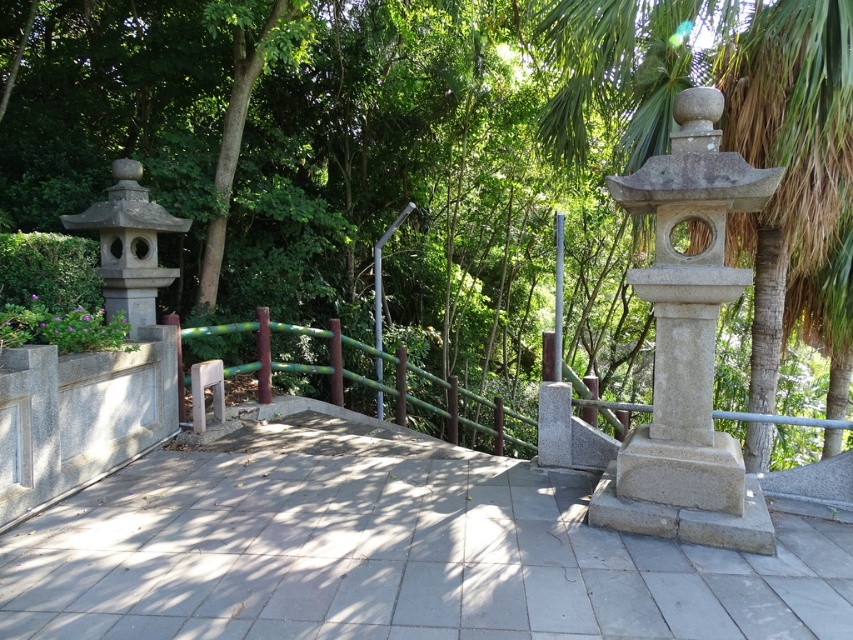
Question: Is green leafy tree at upper center wider than gray concrete path at center?

Choices:
 (A) yes
 (B) no

Answer: (A)

Question: Among these objects, which one is farthest from the camera?

Choices:
 (A) gray concrete path at center
 (B) green bamboo rail at center
 (C) gray stone palm tree at upper right

Answer: (C)

Question: Can you confirm if gray stone lantern at upper right is smaller than green bamboo rail at center?

Choices:
 (A) yes
 (B) no

Answer: (A)

Question: Is green leafy tree at upper center thinner than gray concrete path at center?

Choices:
 (A) no
 (B) yes

Answer: (A)

Question: Which object is closer to the camera taking this photo?

Choices:
 (A) green leafy tree at upper center
 (B) gray stone lantern at upper right
 (C) gray stone palm tree at upper right

Answer: (B)

Question: Which of the following is the farthest from the observer?

Choices:
 (A) (373, 497)
 (B) (711, 481)

Answer: (A)